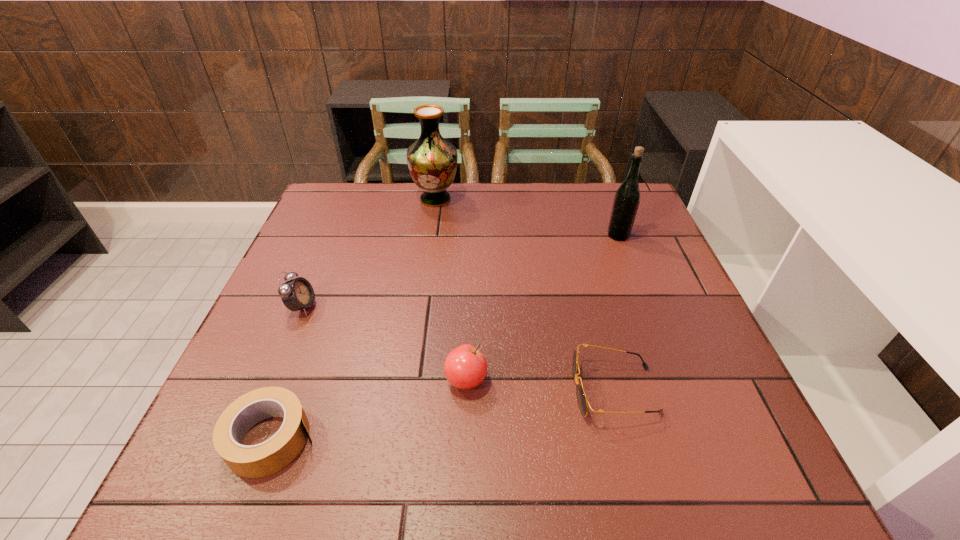
At what (x,y) coordinates should I click in order to perform the action: click on vacant region that satisfies the following two spatial constraints: 1. on the front side of the farthest object; 2. on the right side of the rightmost object. Please return your answer as a coordinate pair (x, y). The width and height of the screenshot is (960, 540). Looking at the image, I should click on (430, 235).